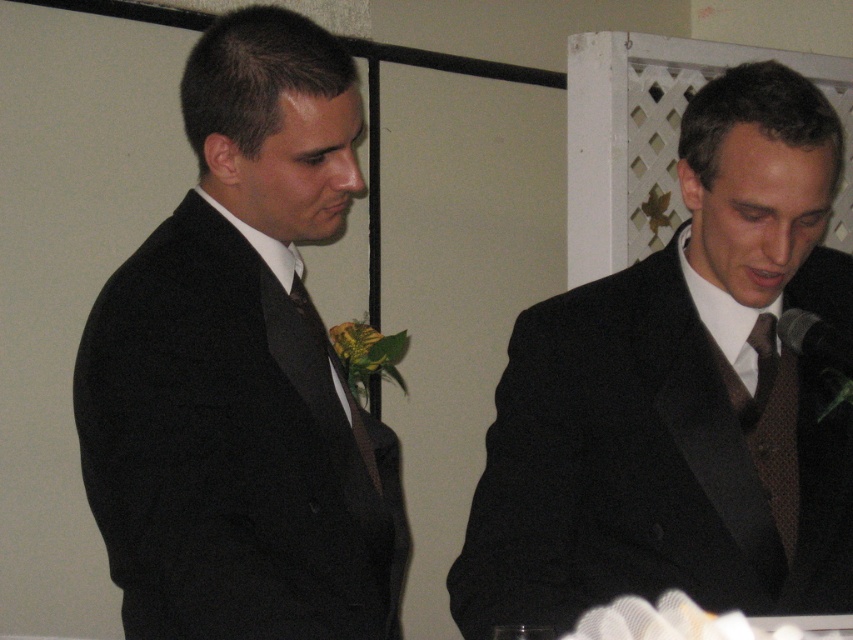
You are at a formal event and need to locate the speaker who is wearing a matte black suit at left and a brown dotted tie at right. Based on their positions, which one is more to the left?

The matte black suit at left is more to the left than the brown dotted tie at right.

You are at a formal event and need to locate the speaker who is wearing a brown dotted tie at right. From your position facing the stage, which direction should you look to find the black textured suit at center?

The black textured suit at center is to the left of the brown dotted tie at right, so you should look to your left to find the black textured suit at center.